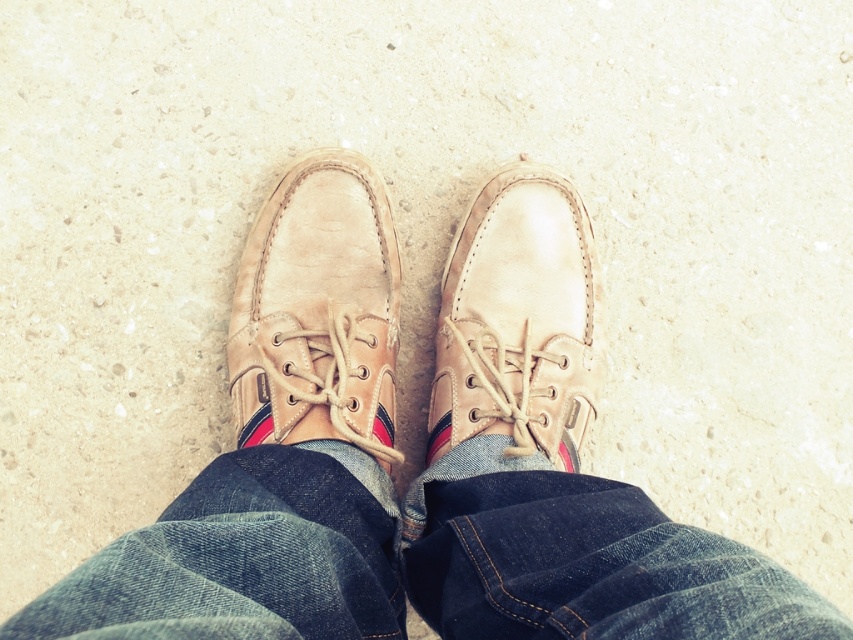
You are a photographer trying to capture the tan leather shoe at center without the denim at center blocking it. Based on the scene description, what adjustment can you make to your camera angle to achieve this?

Since the denim at center is in front of the tan leather shoe at center, you can lower your camera angle to shoot from below, allowing you to capture the tan leather shoe at center without obstruction from the denim at center.

You are a photographer setting up a shoot. You need to ensure that the denim at center is visible in the final photo. Given that the leather shoe at center is currently covering it, what adjustment should you make to the camera angle or subject positioning?

The denim at center is positioned under the leather shoe at center, so to make the denim visible, you should adjust the camera angle to look downward or move the leather shoe at center slightly to expose the denim at center beneath it.

You are a delivery robot that needs to pass between the denim at center and the tan leather shoe at center. The robot is 8 inches wide. Based on the scene, can the robot fit through the space between them?

→ The denim at center and tan leather shoe at center are 8.89 inches apart from each other. Since the robot is 8 inches wide, it can fit through the space between them as the gap is wider than the robot.